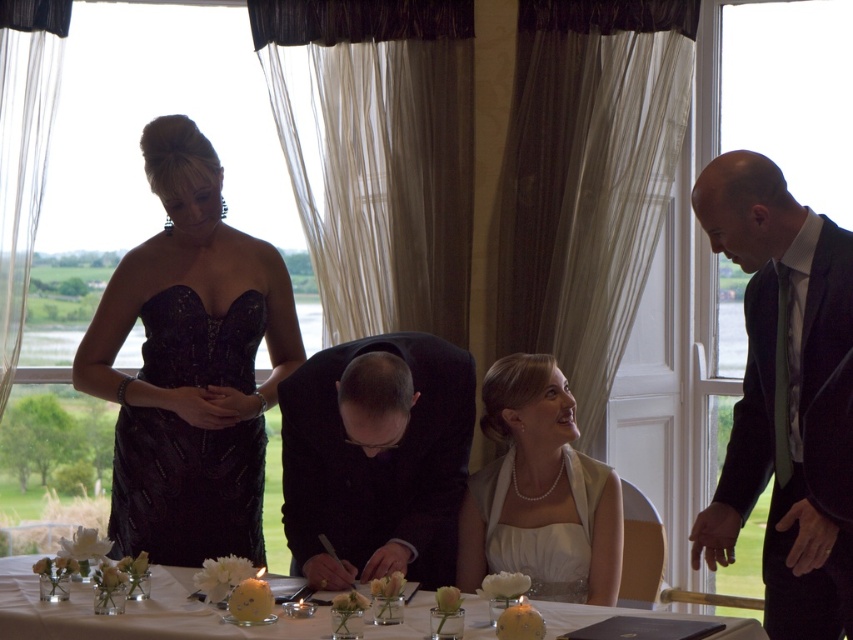
Question: Which of the following is the closest to the observer?

Choices:
 (A) white glass table at center
 (B) black satin suit at center
 (C) pearl white dress at center
 (D) black sequined cocktail dress at left

Answer: (A)

Question: Is dark suit at right closer to camera compared to black satin suit at center?

Choices:
 (A) no
 (B) yes

Answer: (B)

Question: Which object is closer to the camera taking this photo?

Choices:
 (A) black satin suit at center
 (B) pearl white dress at center
 (C) black sequined dress at center
 (D) black sequined cocktail dress at left

Answer: (A)

Question: Can you confirm if black satin suit at center is thinner than pearl white dress at center?

Choices:
 (A) yes
 (B) no

Answer: (B)

Question: Which point is closer to the camera?

Choices:
 (A) (648, 611)
 (B) (543, 444)

Answer: (A)

Question: Does black sequined dress at center appear on the right side of dark suit at right?

Choices:
 (A) no
 (B) yes

Answer: (A)